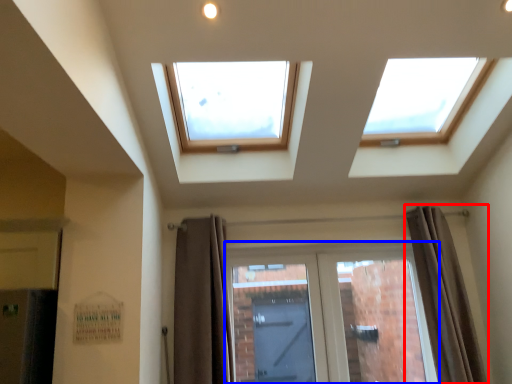
Question: Which point is closer to the camera, curtain (highlighted by a red box) or door (highlighted by a blue box)?

Choices:
 (A) curtain
 (B) door

Answer: (A)